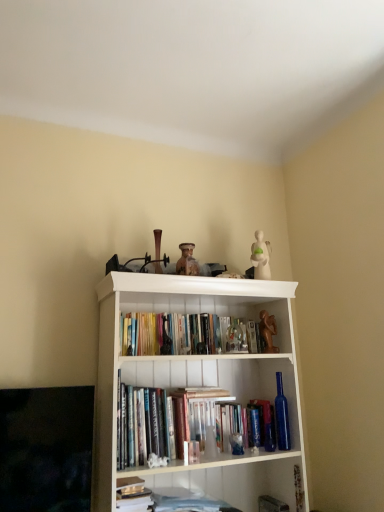
Question: Is hardcover book at lower center, the second book positioned from the top, inside or outside of hardcover books at center, placed as the 1th book when sorted from top to bottom?

Choices:
 (A) outside
 (B) inside

Answer: (A)

Question: From a real-world perspective, is hardcover book at lower center, the 2th book positioned from the bottom, physically located above or below hardcover books at center, which appears as the 3th book when ordered from the bottom?

Choices:
 (A) above
 (B) below

Answer: (B)

Question: Estimate the real-world distances between objects in this image. Which object is closer to the hardcover books at center, which appears as the 3th book when ordered from the bottom?

Choices:
 (A) white matte bookcase at center
 (B) hardcover book at lower center, the second book positioned from the top
 (C) brown matte statue at upper center
 (D) white paper stack at lower center, the third book viewed from the top
 (E) hardcover book at center

Answer: (A)

Question: Which of these objects is positioned farthest from the white paper stack at lower center, the third book viewed from the top?

Choices:
 (A) white matte bookcase at center
 (B) brown matte statue at upper center
 (C) hardcover book at lower center, the second book positioned from the top
 (D) hardcover book at center
 (E) hardcover books at center, placed as the 1th book when sorted from top to bottom

Answer: (B)